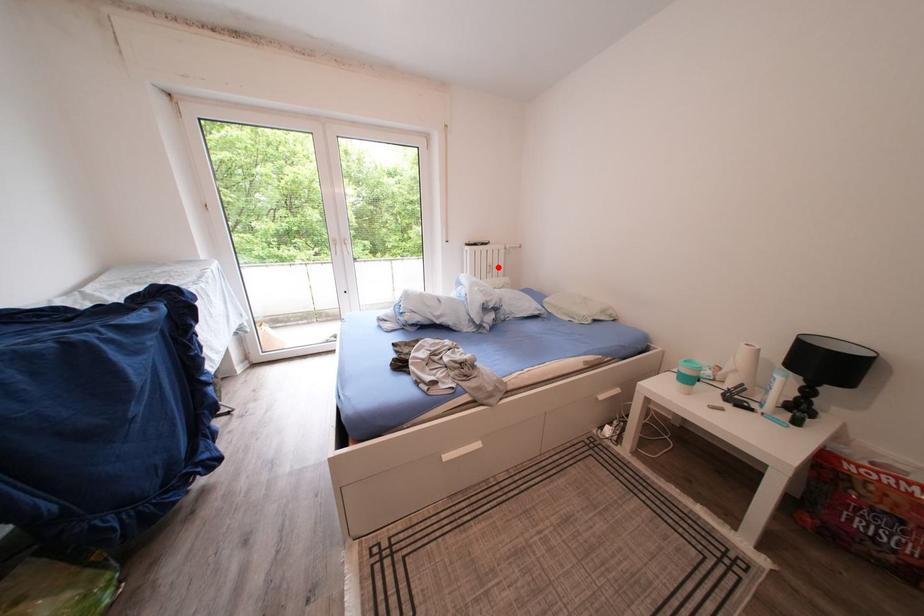
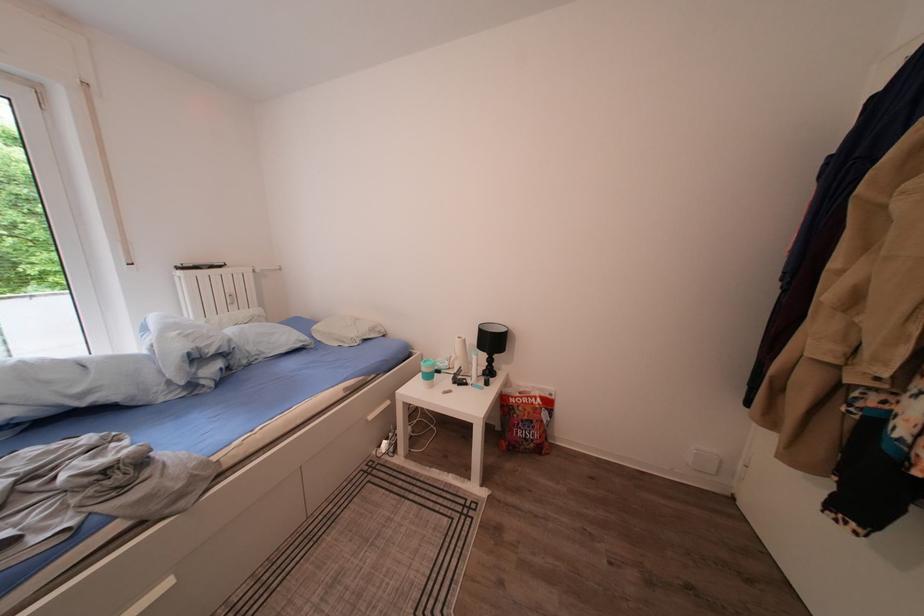
In the second image, find the point that corresponds to the highlighted location in the first image.

(238, 296)